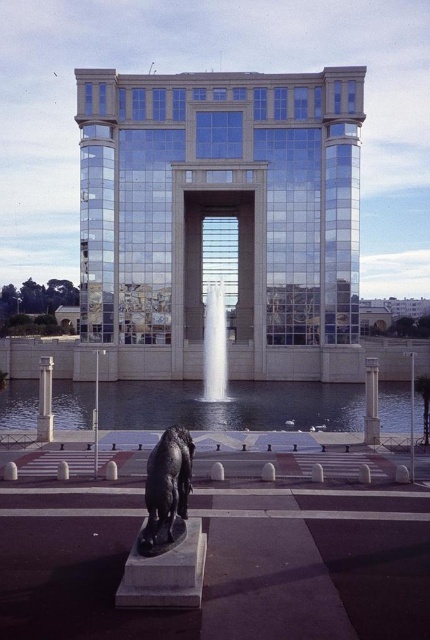
Question: Which is farther from the polished bronze statue at lower left?

Choices:
 (A) slate gray stone pillar at center
 (B) white marble pillar at center
 (C) clear water at center
 (D) white glossy water at center

Answer: (D)

Question: Which of the following is the closest to the observer?

Choices:
 (A) (177, 444)
 (B) (205, 348)
 (C) (199, 401)
 (D) (371, 358)

Answer: (A)

Question: Which object is closer to the camera taking this photo?

Choices:
 (A) white marble pillar at center
 (B) white glossy water at center
 (C) polished bronze statue at lower left
 (D) slate gray stone pillar at center

Answer: (C)

Question: Does clear water at center appear over white marble pillar at center?

Choices:
 (A) no
 (B) yes

Answer: (A)

Question: Is the position of clear water at center more distant than that of polished bronze statue at lower left?

Choices:
 (A) yes
 (B) no

Answer: (A)

Question: Can you confirm if clear water at center is bigger than white marble pillar at center?

Choices:
 (A) yes
 (B) no

Answer: (A)